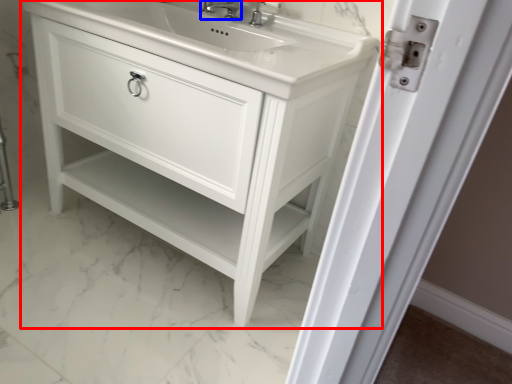
Question: Which object is closer to the camera taking this photo, bathroom cabinet (highlighted by a red box) or tap (highlighted by a blue box)?

Choices:
 (A) bathroom cabinet
 (B) tap

Answer: (A)